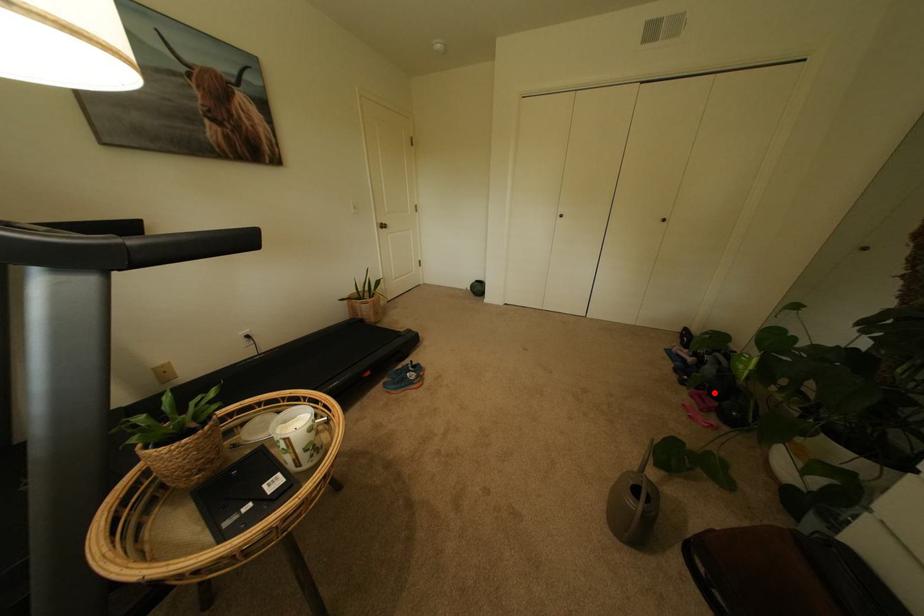
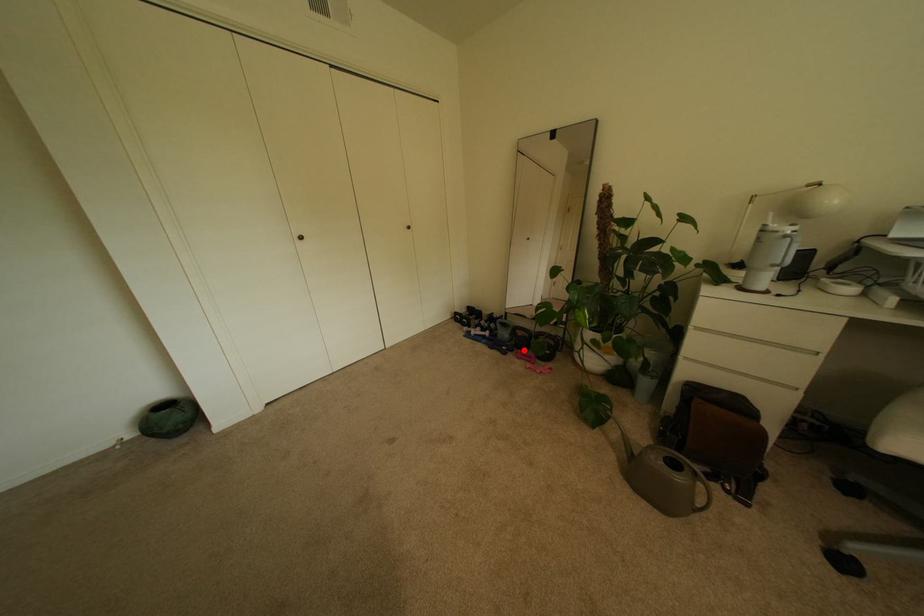
I am providing you with two images of the same scene from different viewpoints. A red point is marked on the first image and another point is marked on the second image. Is the marked point in image1 the same physical position as the marked point in image2?

Yes